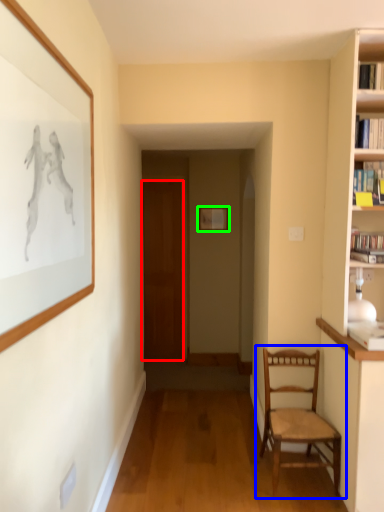
Question: Which object is positioned closest to door (highlighted by a red box)? Select from chair (highlighted by a blue box) and picture frame (highlighted by a green box).

Choices:
 (A) chair
 (B) picture frame

Answer: (B)